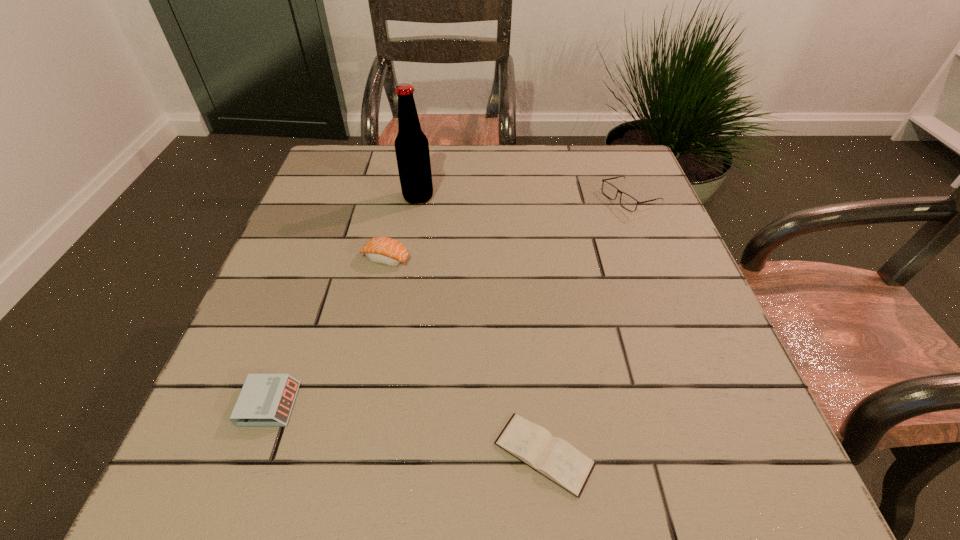
Find the location of a particular element. free space located with the lenses facing outward on the spectacles is located at coordinates (501, 200).

What are the coordinates of `vacant space located 0.360m on the back of the sushi` in the screenshot? It's located at (406, 163).

This screenshot has height=540, width=960. In order to click on vacant space situated on the right of the second shortest object in this screenshot , I will do `click(482, 404)`.

This screenshot has height=540, width=960. I want to click on free space located on the back of the diary, so click(531, 326).

Image resolution: width=960 pixels, height=540 pixels. Identify the location of beer bottle present at the far edge. (411, 145).

Locate an element on the screen. Image resolution: width=960 pixels, height=540 pixels. spectacles that is at the far edge is located at coordinates (629, 203).

Identify the location of object present at the near edge. (553, 457).

Identify the location of object present at the left edge. The width and height of the screenshot is (960, 540). (266, 400).

You are a GUI agent. You are given a task and a screenshot of the screen. Output one action in this format:
    pyautogui.click(x=<x>, y=<y>)
    Task: Click on the object that is at the right edge
    The image size is (960, 540).
    Given the screenshot: What is the action you would take?
    pyautogui.click(x=629, y=203)

The height and width of the screenshot is (540, 960). In order to click on object present at the far right corner in this screenshot , I will do `click(629, 203)`.